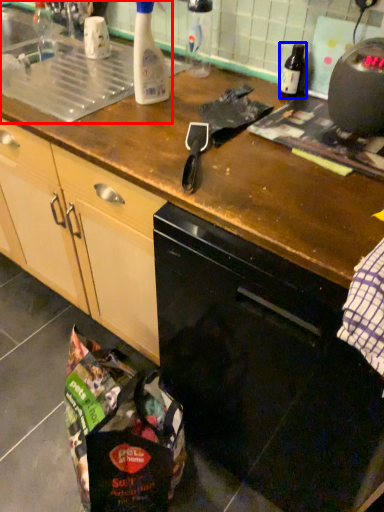
Question: Which point is closer to the camera, sink (highlighted by a red box) or bottle (highlighted by a blue box)?

Choices:
 (A) sink
 (B) bottle

Answer: (A)